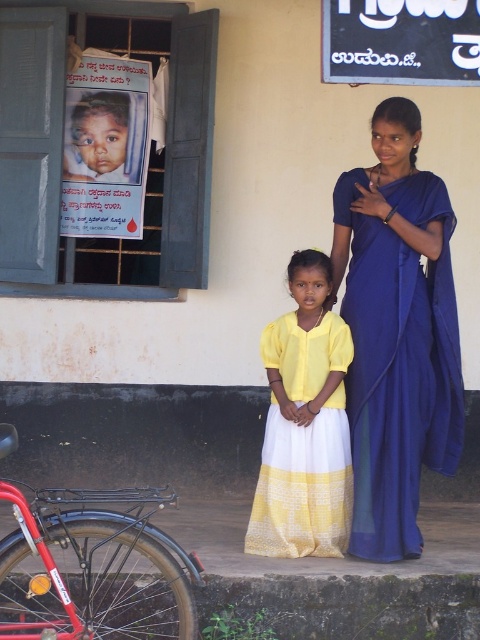
Is blue silk saree at center above red metallic bicycle at lower left?

Correct, blue silk saree at center is located above red metallic bicycle at lower left.

Who is shorter, blue silk saree at center or red metallic bicycle at lower left?

red metallic bicycle at lower left

This screenshot has width=480, height=640. What are the coordinates of `blue silk saree at center` in the screenshot? It's located at (396, 332).

Between blue silk saree at center and yellow cotton dress at center, which one is positioned lower?

yellow cotton dress at center is lower down.

Can you confirm if blue silk saree at center is thinner than yellow cotton dress at center?

No.

Where is `blue silk saree at center`? The height and width of the screenshot is (640, 480). blue silk saree at center is located at coordinates (396, 332).

Is red metallic bicycle at lower left below black matte signboard at upper center?

Yes.

Is point (78, 500) farther from camera compared to point (458, 58)?

Yes, it is behind point (458, 58).

I want to click on red metallic bicycle at lower left, so click(93, 568).

Find the location of a particular element. red metallic bicycle at lower left is located at coordinates (93, 568).